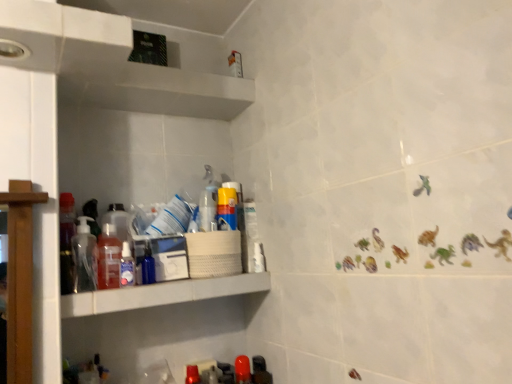
The width and height of the screenshot is (512, 384). I want to click on free space to the right of translucent plastic bottle at shelf left, acting as the third bottle starting from the left, so click(x=162, y=283).